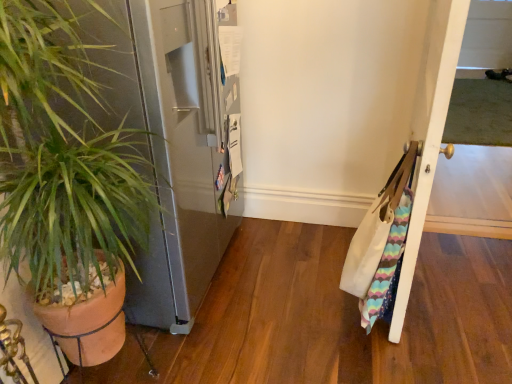
Image resolution: width=512 pixels, height=384 pixels. I want to click on vacant area in front of white wood door at right, so click(x=433, y=339).